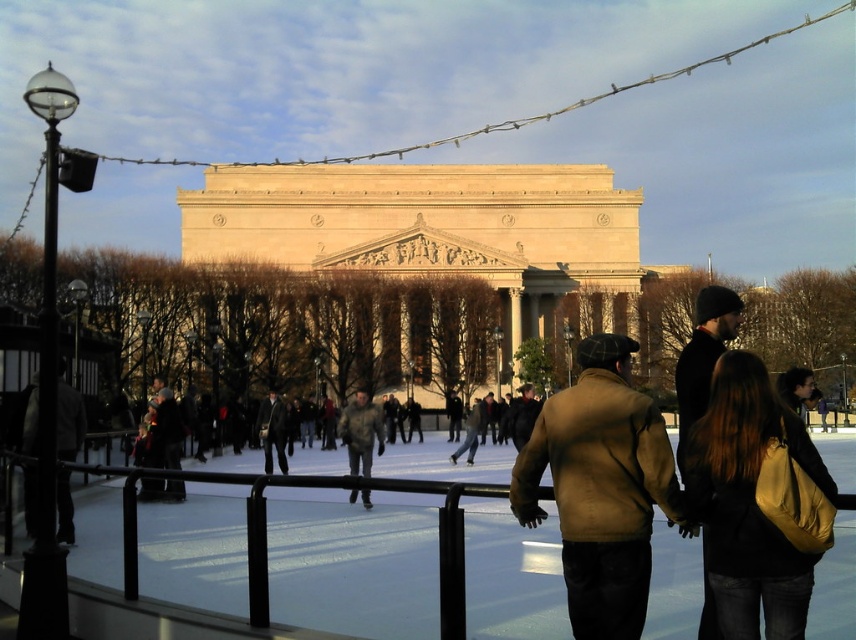
You are a spectator standing at the edge of the white ice skating rink at center and want to hand a scarf to a friend wearing a camouflage jacket at center. The scarf is 2 meters long. Can you throw it to them without leaving your spot?

The distance between the white ice skating rink at center and the camouflage jacket at center is 11.22 meters. Since the scarf is only 2 meters long, it is not possible to throw it that far to reach your friend.